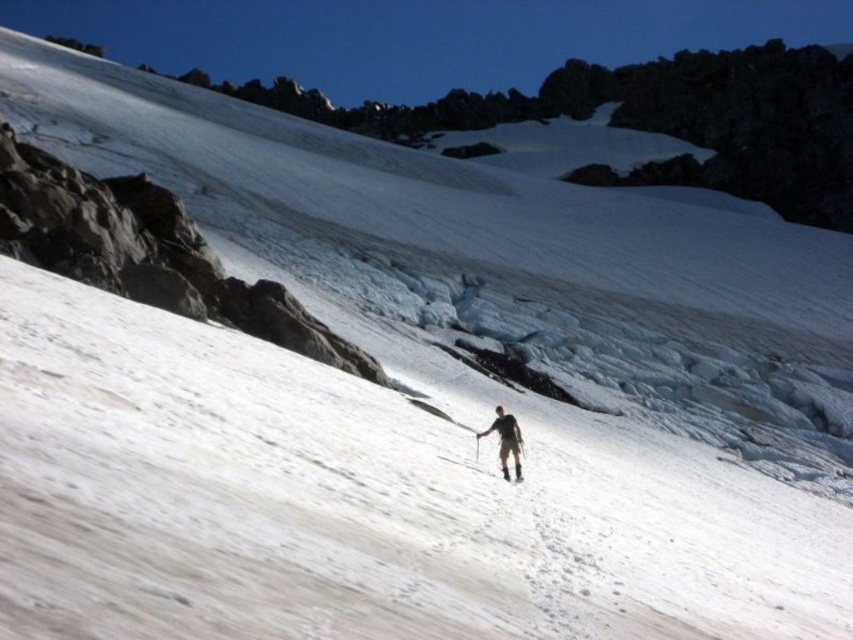
Can you confirm if light brown fabric pants at center is positioned to the right of white matte ski at center?

In fact, light brown fabric pants at center is to the left of white matte ski at center.

Describe the element at coordinates (506, 440) in the screenshot. I see `light brown fabric pants at center` at that location.

Locate an element on the screen. light brown fabric pants at center is located at coordinates click(x=506, y=440).